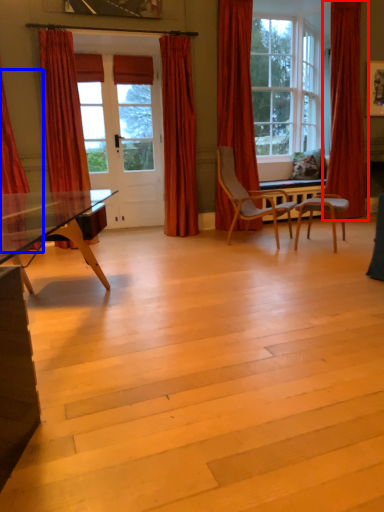
Question: Which of the following is the closest to the observer, curtain (highlighted by a red box) or curtain (highlighted by a blue box)?

Choices:
 (A) curtain
 (B) curtain

Answer: (B)